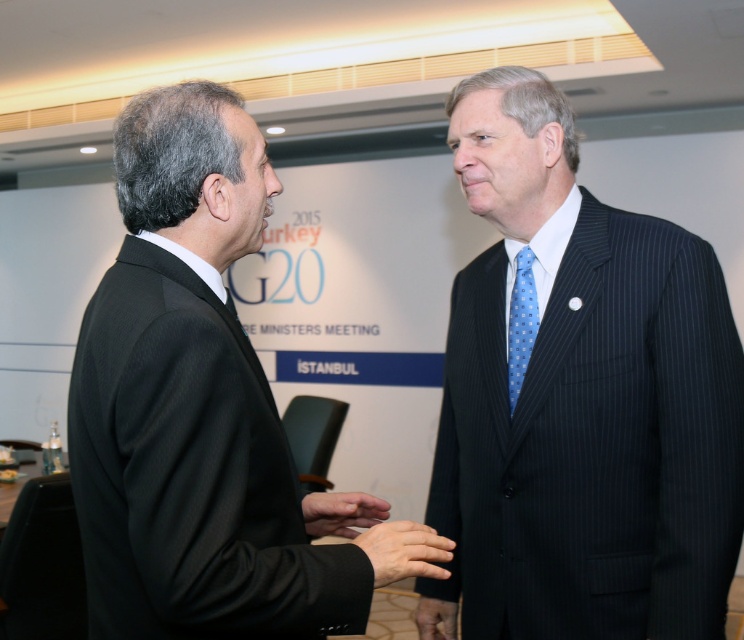
Question: Is matte black hand at center to the left of matte black hand at lower center from the viewer's perspective?

Choices:
 (A) no
 (B) yes

Answer: (B)

Question: Which point is farther to the camera?

Choices:
 (A) smooth skin hand at center
 (B) dark blue pinstripe suit at right
 (C) black pinstripe suit at left

Answer: (B)

Question: Is smooth skin hand at center in front of matte black hand at lower center?

Choices:
 (A) yes
 (B) no

Answer: (A)

Question: Which of these objects is positioned closest to the blue dotted tie at right?

Choices:
 (A) dark blue pinstripe suit at right
 (B) matte black hand at center
 (C) smooth skin hand at center
 (D) matte black hand at lower center

Answer: (A)

Question: Considering the real-world distances, which object is farthest from the smooth skin hand at center?

Choices:
 (A) dark blue pinstripe suit at right
 (B) black pinstripe suit at left

Answer: (A)

Question: Is matte black hand at center behind matte black hand at lower center?

Choices:
 (A) no
 (B) yes

Answer: (A)